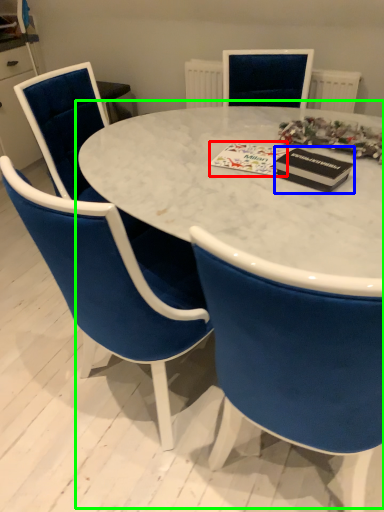
Question: Which is nearer to the christmas card (highlighted by a red box)? magazine (highlighted by a blue box) or table (highlighted by a green box).

Choices:
 (A) magazine
 (B) table

Answer: (A)